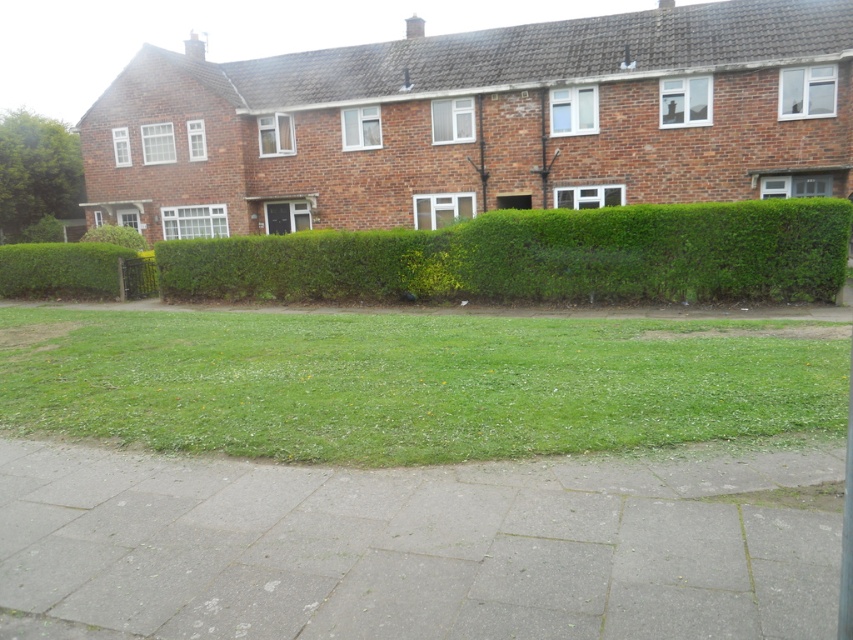
Question: Among these points, which one is farthest from the camera?

Choices:
 (A) (0, 248)
 (B) (19, 136)
 (C) (132, 237)
 (D) (320, 246)

Answer: (B)

Question: Which of these objects is positioned farthest from the green leafy bush at center?

Choices:
 (A) green leafy bush at upper left
 (B) green leafy bush at left

Answer: (A)

Question: Considering the real-world distances, which object is farthest from the green grass at center?

Choices:
 (A) green leafy bush at center
 (B) green leafy bush at upper left
 (C) green leafy hedge at center
 (D) green leafy bush at left

Answer: (B)

Question: Can you confirm if green grass at center is smaller than green leafy bush at left?

Choices:
 (A) yes
 (B) no

Answer: (B)

Question: Observing the image, what is the correct spatial positioning of green grass at center in reference to green leafy bush at left?

Choices:
 (A) left
 (B) right

Answer: (B)

Question: Is green leafy hedge at center to the left of green leafy bush at center from the viewer's perspective?

Choices:
 (A) no
 (B) yes

Answer: (A)